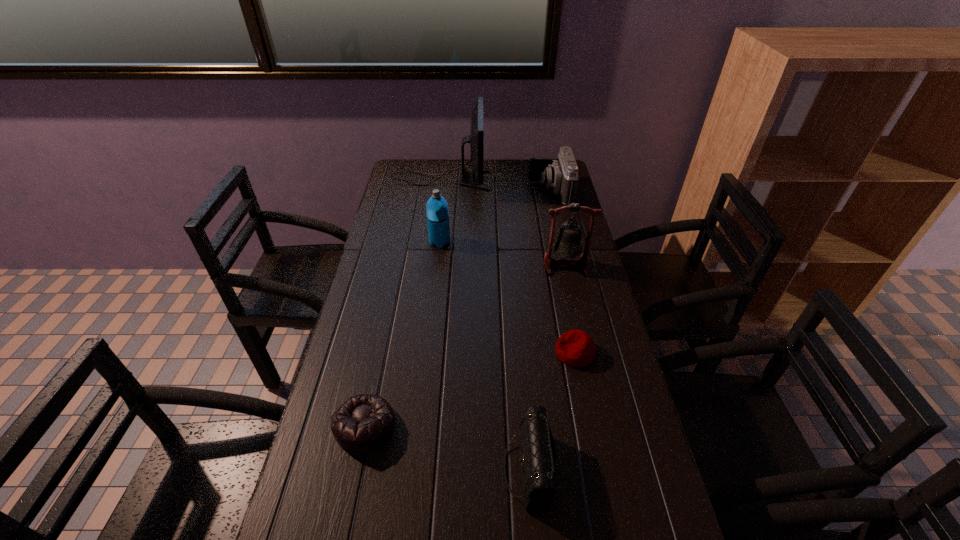
Locate an element on the screen. The image size is (960, 540). object located in the far left corner section of the desktop is located at coordinates (476, 138).

Where is `object that is at the far right corner`? Image resolution: width=960 pixels, height=540 pixels. object that is at the far right corner is located at coordinates (561, 174).

The height and width of the screenshot is (540, 960). In the image, there is a desktop. In order to click on vacant space at the far edge in this screenshot , I will do `click(492, 188)`.

Where is `vacant space at the left edge`? The height and width of the screenshot is (540, 960). vacant space at the left edge is located at coordinates (359, 289).

In the image, there is a desktop. Where is `vacant space at the right edge`? The width and height of the screenshot is (960, 540). vacant space at the right edge is located at coordinates (608, 386).

Find the location of a particular element. free space between the bell and the nearer beanbag is located at coordinates (465, 346).

You are a GUI agent. You are given a task and a screenshot of the screen. Output one action in this format:
    pyautogui.click(x=<x>, y=<y>)
    Task: Click on the vacant space that's between the fourth nearest object and the farther beanbag
    
    Given the screenshot: What is the action you would take?
    pyautogui.click(x=570, y=309)

You are a GUI agent. You are given a task and a screenshot of the screen. Output one action in this format:
    pyautogui.click(x=<x>, y=<y>)
    Task: Click on the free space between the bell and the thermos bottle
    The width and height of the screenshot is (960, 540).
    Given the screenshot: What is the action you would take?
    pyautogui.click(x=503, y=254)

Where is `empty location between the third shortest object and the nearer beanbag`? The width and height of the screenshot is (960, 540). empty location between the third shortest object and the nearer beanbag is located at coordinates (446, 448).

Find the location of a particular element. The width and height of the screenshot is (960, 540). free point between the bell and the thermos bottle is located at coordinates (503, 254).